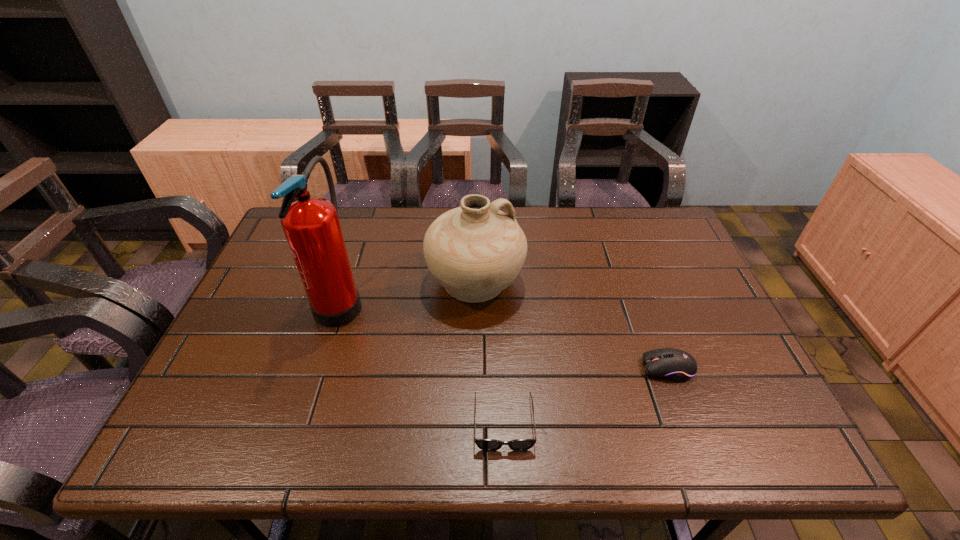
You are a GUI agent. You are given a task and a screenshot of the screen. Output one action in this format:
    pyautogui.click(x=<x>, y=<y>)
    Task: Click on the tallest object
    Image resolution: width=960 pixels, height=540 pixels.
    Given the screenshot: What is the action you would take?
    [x=311, y=225]

At what (x,y) coordinates should I click in order to perform the action: click on fire extinguisher. Please return your answer as a coordinate pair (x, y). The width and height of the screenshot is (960, 540). Looking at the image, I should click on (311, 225).

What are the coordinates of `the second tallest object` in the screenshot? It's located at (475, 251).

You are a GUI agent. You are given a task and a screenshot of the screen. Output one action in this format:
    pyautogui.click(x=<x>, y=<y>)
    Task: Click on the second nearest object
    Image resolution: width=960 pixels, height=540 pixels.
    Given the screenshot: What is the action you would take?
    pyautogui.click(x=676, y=365)

Find the location of a particular element. computer mouse is located at coordinates (676, 365).

Where is `the nearest object`? the nearest object is located at coordinates (484, 444).

The image size is (960, 540). What are the coordinates of `sunglasses` in the screenshot? It's located at (484, 444).

Image resolution: width=960 pixels, height=540 pixels. Identify the location of blank space located 0.250m on the front of the leftmost object. (296, 440).

I want to click on vacant point located 0.170m on the right of the pottery, so click(584, 281).

Where is `free space located on the left of the computer mouse`? Image resolution: width=960 pixels, height=540 pixels. free space located on the left of the computer mouse is located at coordinates (510, 368).